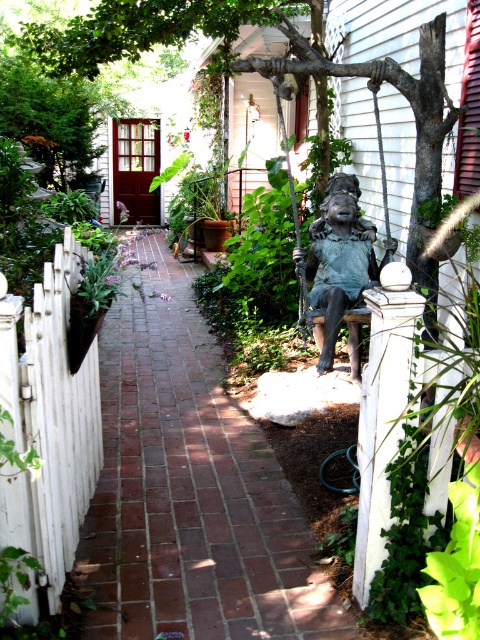
You are standing on the red brick pathway in the garden. You notice the white picket fence at left and the bronze statue at center. Which object is taller when viewed from the pathway?

The bronze statue at center is taller than the white picket fence at left.

You are a gardener who wants to place a new flower pot between the brick at center and the bronze statue at center. According to the scene description, which side of the path should you place it on?

The brick at center is to the left of bronze statue at center, so the path runs between them. Since the brick is on the left side of the path and the statue is on the right side, you should place the flower pot on the center of the path between them.

You are standing at the entrance of the garden and see two points marked in the scene. The first point is at coordinates point [119,426], and the second point is at coordinates point [345,280]. Which point is closer to you as you face the garden entrance?

Point [119,426] is closer to you because it is in front of point [345,280].